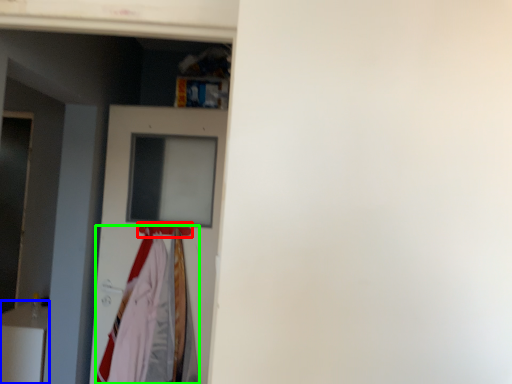
Question: Based on their relative distances, which object is nearer to hanger (highlighted by a red box)? Choose from furniture (highlighted by a blue box) and clothing (highlighted by a green box).

Choices:
 (A) furniture
 (B) clothing

Answer: (B)